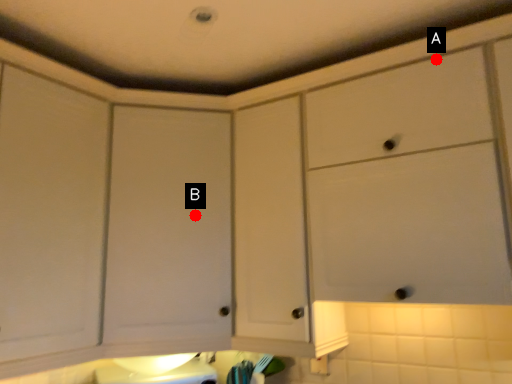
Question: Two points are circled on the image, labeled by A and B beside each circle. Which point is further to the camera?

Choices:
 (A) A is further
 (B) B is further

Answer: (B)